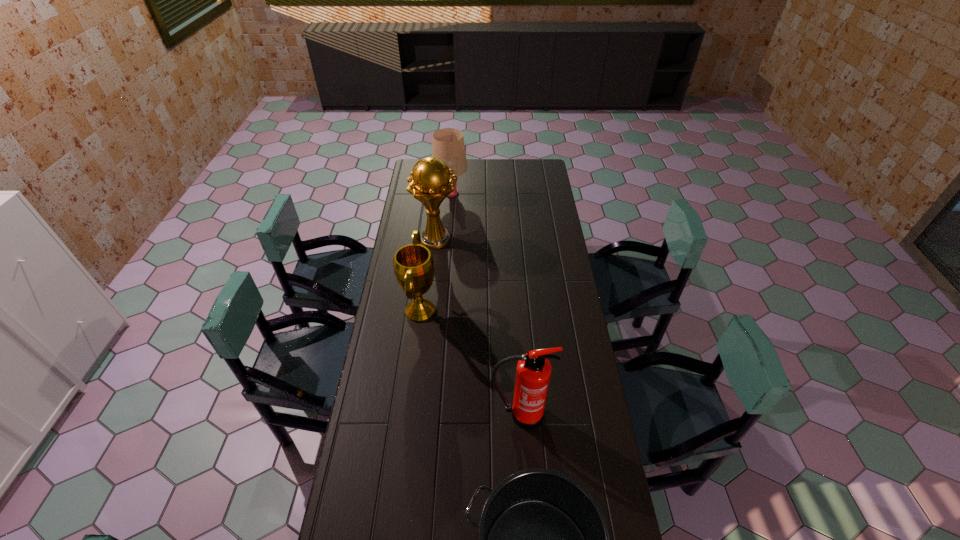
Identify the location of award positioned at the left edge. The image size is (960, 540). (413, 264).

The width and height of the screenshot is (960, 540). In the image, there is a desktop. Identify the location of vacant space at the far edge. (483, 166).

In the image, there is a desktop. What are the coordinates of `free space at the left edge` in the screenshot? It's located at (341, 539).

Where is `vacant space at the right edge of the desktop`? Image resolution: width=960 pixels, height=540 pixels. vacant space at the right edge of the desktop is located at coordinates (590, 417).

Where is `vacant position at the far right corner of the desktop`? This screenshot has height=540, width=960. vacant position at the far right corner of the desktop is located at coordinates (547, 165).

Where is `free space that is in between the farthest object and the fire extinguisher`? free space that is in between the farthest object and the fire extinguisher is located at coordinates (485, 303).

This screenshot has height=540, width=960. Find the location of `free space that is in between the lampshade and the third farthest object`. free space that is in between the lampshade and the third farthest object is located at coordinates (436, 252).

Identify the location of vacant area that lies between the second nearest object and the trophy_cup. (478, 327).

Identify the location of vacant space in between the fire extinguisher and the lampshade. (485, 303).

Find the location of a particular element. Image resolution: width=960 pixels, height=540 pixels. object that is the closest to the award is located at coordinates (430, 184).